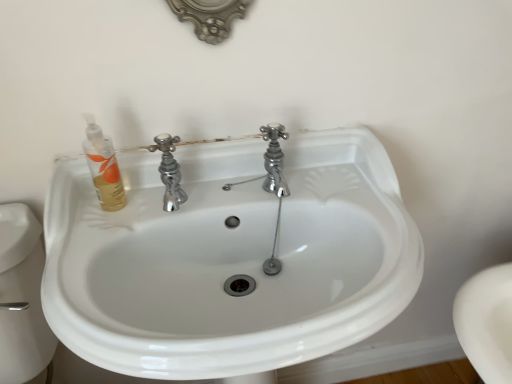
The image size is (512, 384). I want to click on translucent gold liquid soap at upper left, so click(103, 167).

Describe the element at coordinates (103, 167) in the screenshot. I see `translucent gold liquid soap at upper left` at that location.

What is the approximate height of white glossy sink at center?

90.47 centimeters.

The width and height of the screenshot is (512, 384). Find the location of `white glossy sink at center`. white glossy sink at center is located at coordinates (230, 259).

The height and width of the screenshot is (384, 512). Describe the element at coordinates (230, 259) in the screenshot. I see `white glossy sink at center` at that location.

Where is `translucent gold liquid soap at upper left`? The image size is (512, 384). translucent gold liquid soap at upper left is located at coordinates (103, 167).

Which object is positioned more to the left, white glossy sink at center or translucent gold liquid soap at upper left?

translucent gold liquid soap at upper left is more to the left.

Is the position of white glossy sink at center less distant than that of translucent gold liquid soap at upper left?

Yes, the depth of white glossy sink at center is less than that of translucent gold liquid soap at upper left.

Is point (144, 273) farther from viewer compared to point (122, 197)?

That is False.

From the image's perspective, is white glossy sink at center on top of translucent gold liquid soap at upper left?

No, from the image's perspective, white glossy sink at center is not on top of translucent gold liquid soap at upper left.

From a real-world perspective, is white glossy sink at center located beneath translucent gold liquid soap at upper left?

Correct, in the physical world, white glossy sink at center is lower than translucent gold liquid soap at upper left.

Considering the relative sizes of white glossy sink at center and translucent gold liquid soap at upper left in the image provided, is white glossy sink at center thinner than translucent gold liquid soap at upper left?

No.

Based on the photo, which of these two, white glossy sink at center or translucent gold liquid soap at upper left, stands shorter?

translucent gold liquid soap at upper left is shorter.

Who is smaller, white glossy sink at center or translucent gold liquid soap at upper left?

translucent gold liquid soap at upper left is smaller.

Is translucent gold liquid soap at upper left surrounded by white glossy sink at center?

That's correct, translucent gold liquid soap at upper left is inside white glossy sink at center.

Is white glossy sink at center with translucent gold liquid soap at upper left?

white glossy sink at center and translucent gold liquid soap at upper left are clearly separated.

Is white glossy sink at center positioned with its back to translucent gold liquid soap at upper left?

white glossy sink at center does not have its back to translucent gold liquid soap at upper left.

This screenshot has height=384, width=512. Find the location of `sink on the right of the translucent gold liquid soap at upper left`. sink on the right of the translucent gold liquid soap at upper left is located at coordinates (230, 259).

Between translucent gold liquid soap at upper left and white glossy sink at center, which one appears on the right side from the viewer's perspective?

Positioned to the right is white glossy sink at center.

Between translucent gold liquid soap at upper left and white glossy sink at center, which one is positioned behind?

translucent gold liquid soap at upper left is further from the camera.

Which point is more forward, (115, 165) or (244, 204)?

The point (244, 204) is closer.

From the image's perspective, would you say translucent gold liquid soap at upper left is positioned over white glossy sink at center?

Correct, translucent gold liquid soap at upper left appears higher than white glossy sink at center in the image.

From a real-world perspective, is translucent gold liquid soap at upper left positioned over white glossy sink at center based on gravity?

Yes.

Which object is wider, translucent gold liquid soap at upper left or white glossy sink at center?

With larger width is white glossy sink at center.

Considering the relative sizes of translucent gold liquid soap at upper left and white glossy sink at center in the image provided, is translucent gold liquid soap at upper left taller than white glossy sink at center?

No, translucent gold liquid soap at upper left is not taller than white glossy sink at center.

Who is bigger, translucent gold liquid soap at upper left or white glossy sink at center?

With larger size is white glossy sink at center.

Is translucent gold liquid soap at upper left outside of white glossy sink at center?

No, most part of translucent gold liquid soap at upper left lies within white glossy sink at center.

Is there a large distance between translucent gold liquid soap at upper left and white glossy sink at center?

translucent gold liquid soap at upper left is near white glossy sink at center, not far away.

Does translucent gold liquid soap at upper left turn towards white glossy sink at center?

No, translucent gold liquid soap at upper left is not turned towards white glossy sink at center.

Identify the location of toiletry on the left of white glossy sink at center. (103, 167).

Identify the location of sink located on the right of translucent gold liquid soap at upper left. Image resolution: width=512 pixels, height=384 pixels. (230, 259).

Find the location of `toiletry located on the left of white glossy sink at center`. toiletry located on the left of white glossy sink at center is located at coordinates click(103, 167).